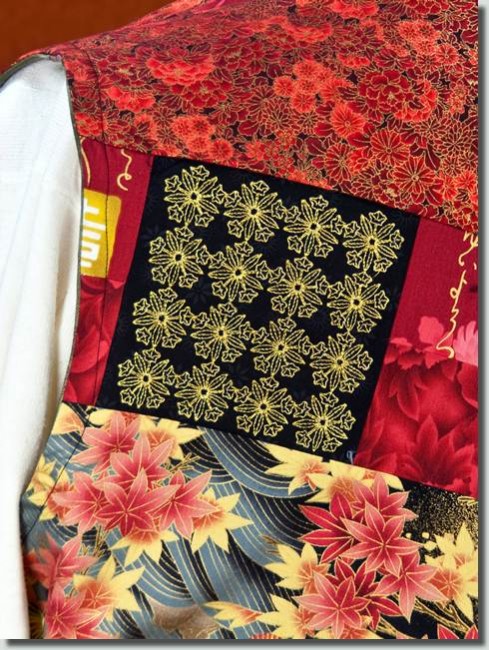
Where is `pillow case`? The height and width of the screenshot is (650, 489). pillow case is located at coordinates (388, 431).